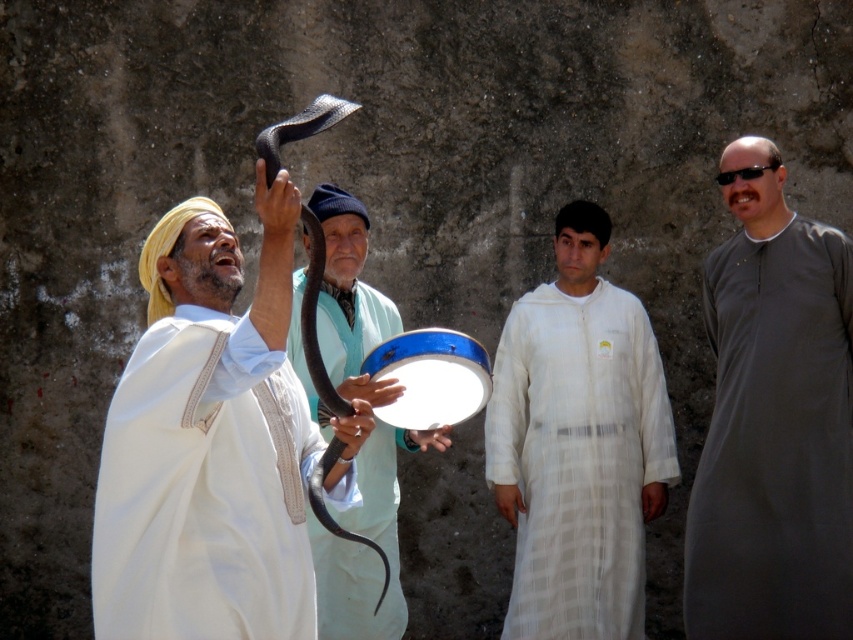
Question: Does smooth white robe at left have a greater width compared to black matte snake at upper center?

Choices:
 (A) yes
 (B) no

Answer: (A)

Question: Which object is the closest to the light blue fabric at center?

Choices:
 (A) gray matte robe at center
 (B) smooth white robe at left
 (C) white textured robe at center
 (D) black matte snake at upper center

Answer: (C)

Question: Is white textured robe at center wider than light blue fabric at center?

Choices:
 (A) yes
 (B) no

Answer: (A)

Question: Among these objects, which one is farthest from the camera?

Choices:
 (A) smooth white robe at left
 (B) gray matte robe at center
 (C) black matte snake at upper center

Answer: (B)

Question: In this image, where is white textured robe at center located relative to black matte snake at upper center?

Choices:
 (A) right
 (B) left

Answer: (A)

Question: Which point is farther to the camera?

Choices:
 (A) (289, 492)
 (B) (254, 177)
 (C) (653, 468)
 (D) (311, 381)

Answer: (B)